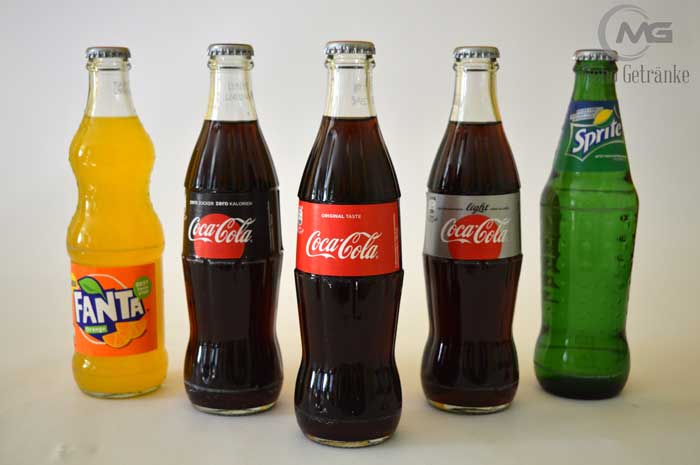
Locate an element on the screen. Image resolution: width=700 pixels, height=465 pixels. glass bottle is located at coordinates (113, 228), (239, 169), (351, 170), (480, 164), (593, 232).